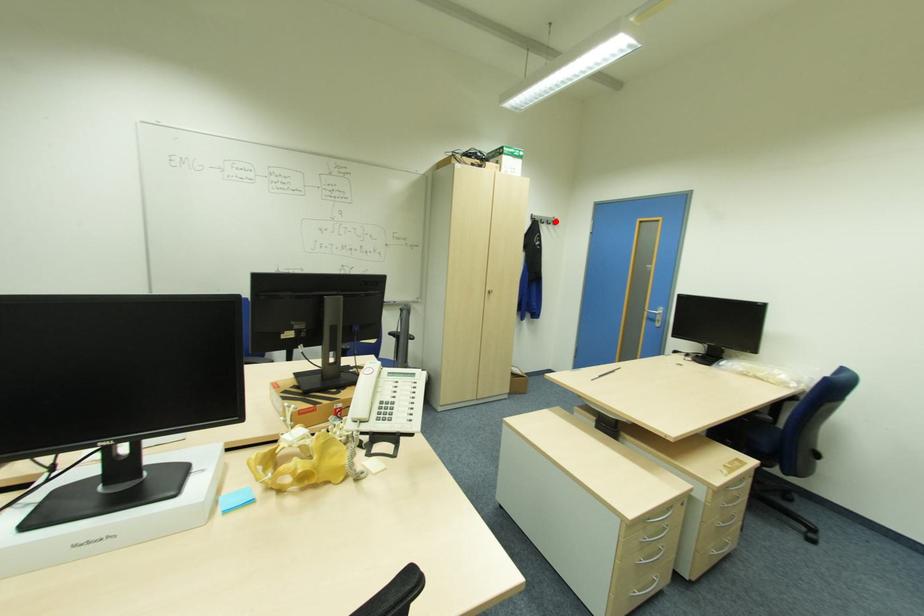
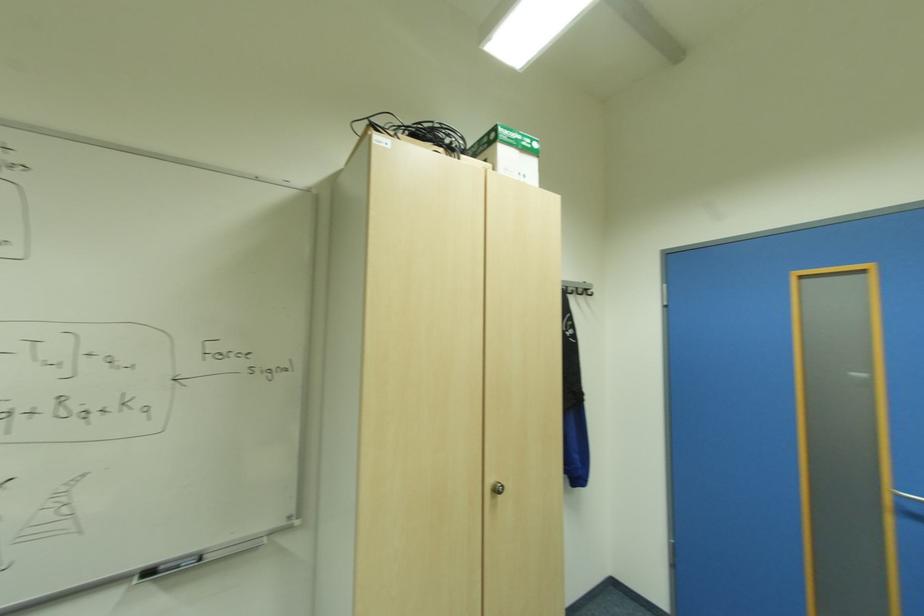
Find the pixel in the second image that matches the highlighted location in the first image.

(588, 291)